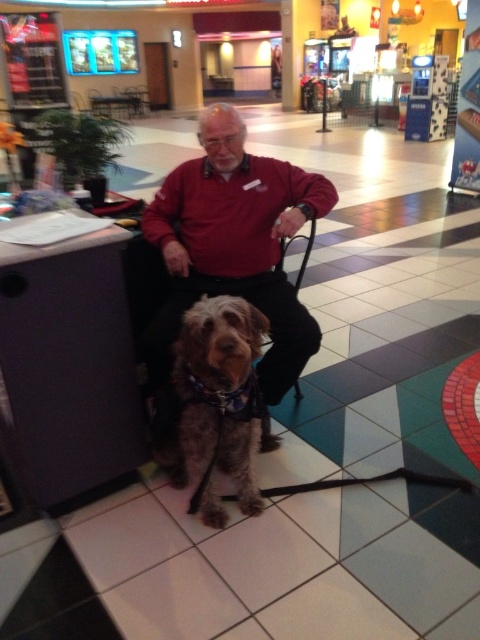
Is matte red shirt at center further to the viewer compared to fuzzy brown dog at center?

Yes, it is behind fuzzy brown dog at center.

Does matte red shirt at center have a greater height compared to fuzzy brown dog at center?

Indeed, matte red shirt at center has a greater height compared to fuzzy brown dog at center.

Identify the location of matte red shirt at center. (230, 252).